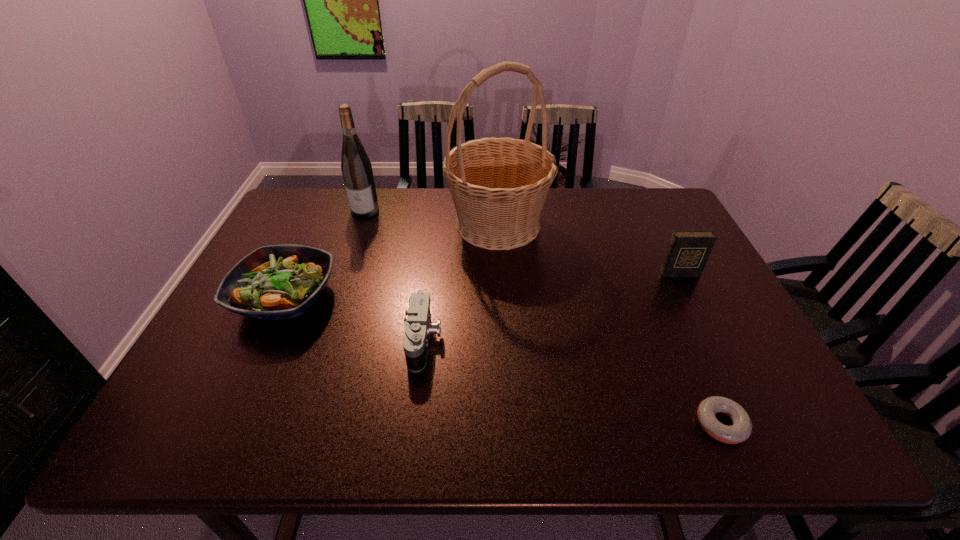
Image resolution: width=960 pixels, height=540 pixels. I want to click on vacant space that satisfies the following two spatial constraints: 1. on the front side of the second tallest object; 2. on the left side of the basket, so click(360, 224).

The image size is (960, 540). I want to click on vacant region that satisfies the following two spatial constraints: 1. on the back side of the shortest object; 2. on the lens of the camera, so click(x=684, y=341).